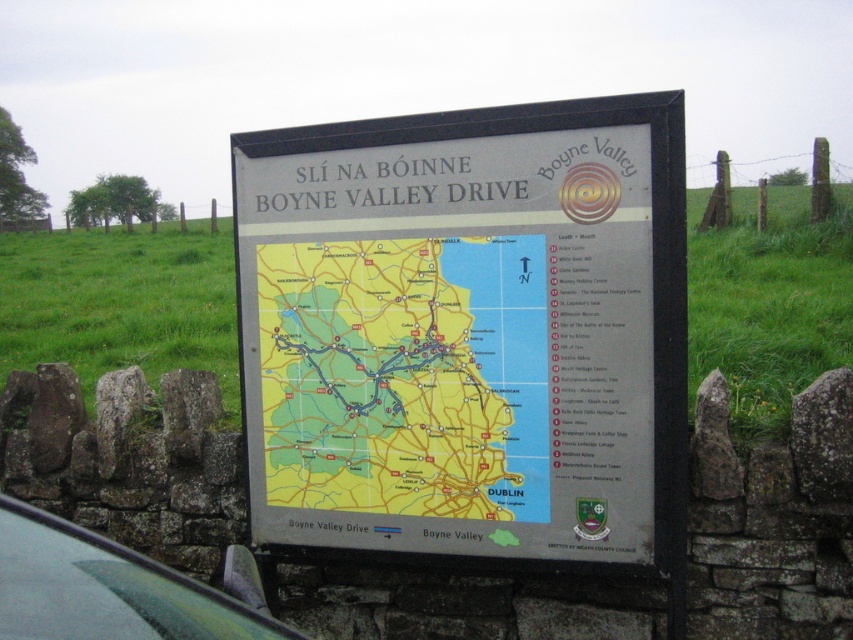
You are a tourist standing at the signboard and see the yellow paper map at center and the green matte car at lower left. Which object is positioned to the right of the other?

The yellow paper map at center is to the right of green matte car at lower left.

In the scene shown: You are standing in front of the signboard titled SLIN NA BONNE BOYNE VALLEY DRIVE. You want to locate the yellow paper map at center on the signboard. Where should you look relative to the compass rose at the top right corner?

The yellow paper map at center is located at point (x=405, y=376) on the signboard. Since the compass rose is at the top right corner, the yellow paper map at center is positioned to the lower left of the compass rose.

You are standing in front of the signboard titled SLIN NA BONNE BOYNE VALLEY DRIVE. You see a point marked at coordinates (405,376). What is located at that point?

At point (405,376) lies yellow paper map at center.